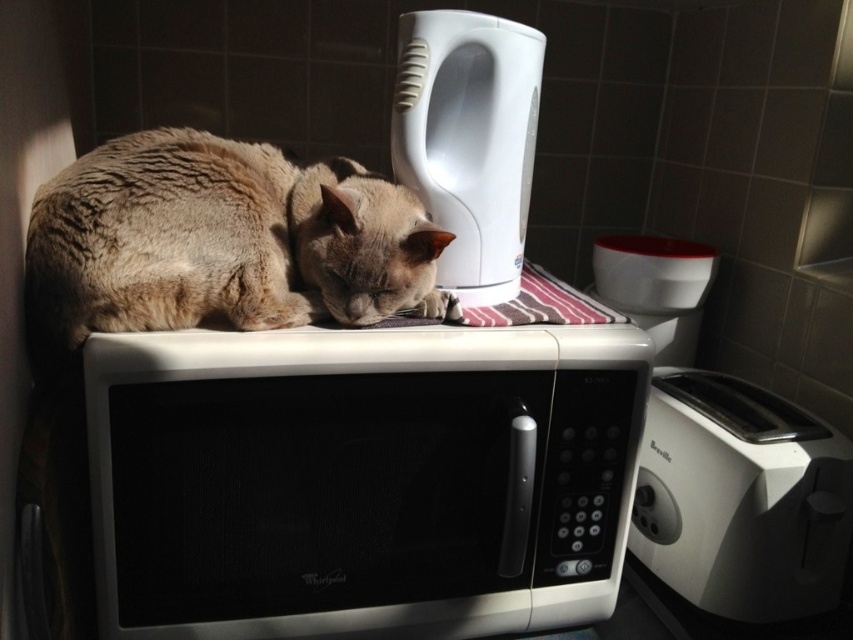
You are a person standing in front of the microwave. You want to reach the white matte microwave at upper center to press the start button. Can you comfortably press the button without moving your hand too far away?

The white matte microwave at upper center is 24.03 inches away from the viewer, which is a comfortable distance to press the start button without needing to stretch too far.

You are a chef preparing breakfast and need to reach the white plastic toaster at right. There is a white matte microwave at upper center in the way. Can you move the microwave to access the toaster?

The white matte microwave at upper center is positioned over the white plastic toaster at right, so you cannot move the microwave to access the toaster because it is already above the toaster.

Looking at this image, you are a delivery robot that needs to place a small package on the counter near the white matte microwave at upper center. The package must be placed within a 0.1 meter radius of the microwave. Can you confirm if the coordinates provided for the microwave at point 0.750, 0.426 will allow the package to be placed within the required radius?

The white matte microwave at upper center is located at point (x=363, y=480). Since the package needs to be placed within a 0.1 meter radius of this point, the coordinates provided are suitable for placing the package within the required radius.